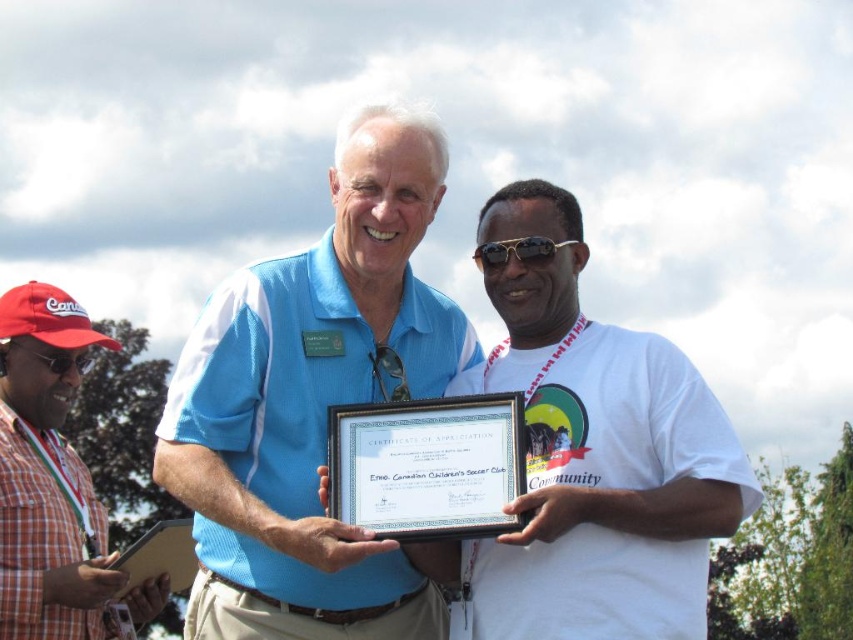
You are a photographer trying to capture a group photo of the two people holding the certificate. You notice the red plaid shirt at left and the gold metallic sunglasses at center in the background. Which object should you adjust your camera angle to avoid blocking the certificate holders?

The red plaid shirt at left is wider than the gold metallic sunglasses at center, so adjusting the camera angle to avoid the red plaid shirt at left would prevent blocking the certificate holders more effectively.